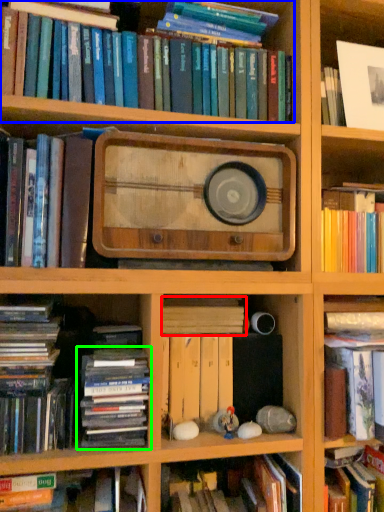
Question: Considering the real-world distances, which object is closest to book (highlighted by a red box)? book (highlighted by a blue box) or book (highlighted by a green box).

Choices:
 (A) book
 (B) book

Answer: (B)